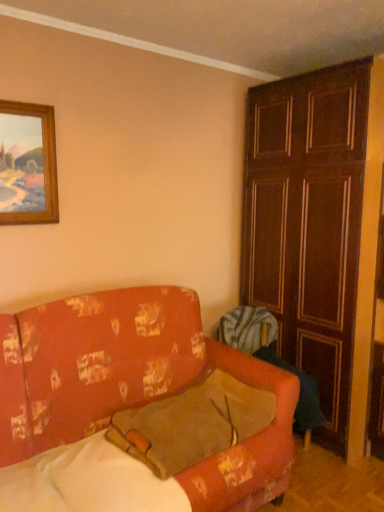
In order to click on brown suede pillow at center in this screenshot , I will do `click(192, 423)`.

Can you tell me how much floral-patterned fabric couch at lower left and brown suede pillow at center differ in facing direction?

The facing directions of floral-patterned fabric couch at lower left and brown suede pillow at center are 0.32 degrees apart.

Who is smaller, floral-patterned fabric couch at lower left or brown suede pillow at center?

With smaller size is brown suede pillow at center.

Which is correct: floral-patterned fabric couch at lower left is inside brown suede pillow at center, or outside of it?

floral-patterned fabric couch at lower left exists outside the volume of brown suede pillow at center.

Considering the relative positions of floral-patterned fabric couch at lower left and brown suede pillow at center in the image provided, is floral-patterned fabric couch at lower left to the right of brown suede pillow at center from the viewer's perspective?

In fact, floral-patterned fabric couch at lower left is to the left of brown suede pillow at center.

Considering the relative sizes of wooden picture frame at upper left and floral-patterned fabric couch at lower left in the image provided, is wooden picture frame at upper left smaller than floral-patterned fabric couch at lower left?

Yes.

Who is shorter, wooden picture frame at upper left or floral-patterned fabric couch at lower left?

wooden picture frame at upper left is shorter.

Between wooden picture frame at upper left and floral-patterned fabric couch at lower left, which one has larger width?

Wider between the two is floral-patterned fabric couch at lower left.

Is point (180, 433) farther from camera compared to point (346, 254)?

No.

Looking at this image, is brown suede pillow at center positioned with its back to wooden panelled door at right?

brown suede pillow at center is not turned away from wooden panelled door at right.

How distant is brown suede pillow at center from wooden panelled door at right?

brown suede pillow at center is 3.40 feet from wooden panelled door at right.

Does brown suede pillow at center lie in front of wooden panelled door at right?

That is True.

Does wooden picture frame at upper left come behind brown suede pillow at center?

Yes, wooden picture frame at upper left is further from the camera.

Is wooden picture frame at upper left situated inside brown suede pillow at center or outside?

wooden picture frame at upper left is not inside brown suede pillow at center, it's outside.

From a real-world perspective, does wooden picture frame at upper left stand above brown suede pillow at center?

Yes, from a real-world perspective, wooden picture frame at upper left is above brown suede pillow at center.

Is floral-patterned fabric couch at lower left wider or thinner than wooden panelled door at right?

In the image, floral-patterned fabric couch at lower left appears to be wider than wooden panelled door at right.

Which is farther from the camera, (80, 403) or (290, 214)?

Positioned behind is point (290, 214).

Does floral-patterned fabric couch at lower left appear on the left side of wooden panelled door at right?

Yes.

Is wooden picture frame at upper left with wooden panelled door at right?

There is a gap between wooden picture frame at upper left and wooden panelled door at right.

Is wooden picture frame at upper left shorter than wooden panelled door at right?

Indeed, wooden picture frame at upper left has a lesser height compared to wooden panelled door at right.

From the image's perspective, is wooden picture frame at upper left positioned above or below wooden panelled door at right?

Based on their image positions, wooden picture frame at upper left is located above wooden panelled door at right.

Is brown suede pillow at center at the left side of wooden picture frame at upper left?

In fact, brown suede pillow at center is to the right of wooden picture frame at upper left.

At what (x,y) coordinates should I click in order to perform the action: click on pillow in front of the wooden picture frame at upper left. Please return your answer as a coordinate pair (x, y). Looking at the image, I should click on (192, 423).

From a real-world perspective, which object stands above the other?

wooden picture frame at upper left is physically above.

There is a floral-patterned fabric couch at lower left. Where is `pillow above it (from a real-world perspective)`? Image resolution: width=384 pixels, height=512 pixels. pillow above it (from a real-world perspective) is located at coordinates (192, 423).

Locate an element on the screen. picture frame above the floral-patterned fabric couch at lower left (from the image's perspective) is located at coordinates (27, 164).

When comparing their distances from floral-patterned fabric couch at lower left, does wooden panelled door at right or brown suede pillow at center seem further?

Among the two, wooden panelled door at right is located further to floral-patterned fabric couch at lower left.

Which object lies nearer to the anchor point brown suede pillow at center, wooden picture frame at upper left or floral-patterned fabric couch at lower left?

The object closer to brown suede pillow at center is floral-patterned fabric couch at lower left.

Looking at the image, which one is located further to wooden picture frame at upper left, brown suede pillow at center or wooden panelled door at right?

Among the two, wooden panelled door at right is located further to wooden picture frame at upper left.

Estimate the real-world distances between objects in this image. Which object is closer to wooden panelled door at right, wooden picture frame at upper left or floral-patterned fabric couch at lower left?

Among the two, floral-patterned fabric couch at lower left is located nearer to wooden panelled door at right.

In the scene shown: Estimate the real-world distances between objects in this image. Which object is further from wooden panelled door at right, floral-patterned fabric couch at lower left or brown suede pillow at center?

floral-patterned fabric couch at lower left is positioned further to the anchor wooden panelled door at right.

Based on the photo, considering their positions, is wooden panelled door at right positioned further to brown suede pillow at center than floral-patterned fabric couch at lower left?

The object further to brown suede pillow at center is wooden panelled door at right.

When comparing their distances from wooden picture frame at upper left, does wooden panelled door at right or brown suede pillow at center seem closer?

brown suede pillow at center is closer to wooden picture frame at upper left.

Based on their spatial positions, is floral-patterned fabric couch at lower left or wooden panelled door at right closer to wooden picture frame at upper left?

floral-patterned fabric couch at lower left.

Identify the location of pillow between floral-patterned fabric couch at lower left and wooden panelled door at right in the horizontal direction. (192, 423).

This screenshot has width=384, height=512. I want to click on studio couch located between wooden picture frame at upper left and wooden panelled door at right in the left-right direction, so click(x=137, y=409).

Find the location of a particular element. pillow between wooden picture frame at upper left and wooden panelled door at right in the horizontal direction is located at coordinates (192, 423).

Where is `pillow between wooden picture frame at upper left and floral-patterned fabric couch at lower left from top to bottom`? This screenshot has width=384, height=512. pillow between wooden picture frame at upper left and floral-patterned fabric couch at lower left from top to bottom is located at coordinates click(192, 423).